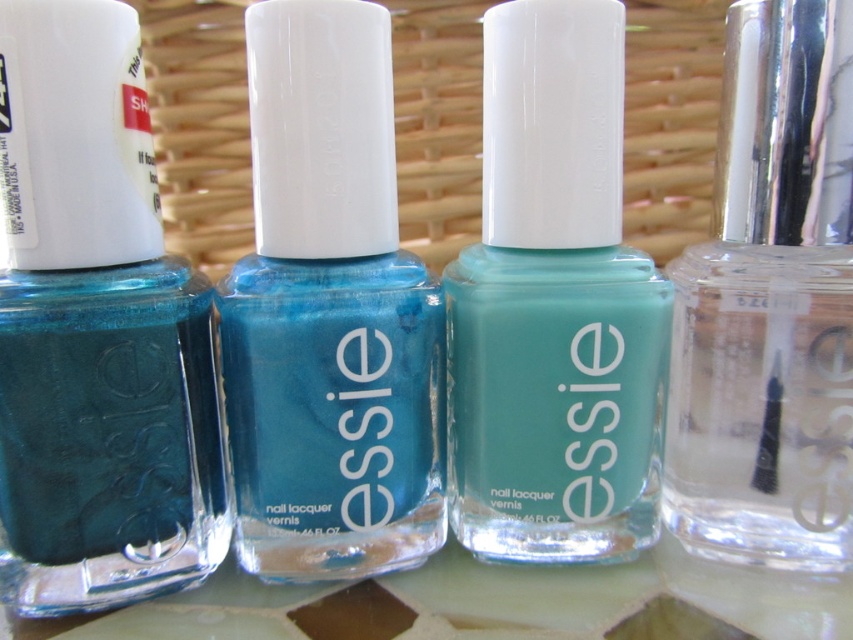
Who is more distant from viewer, (x=393, y=221) or (x=595, y=205)?

Point (x=595, y=205)

Can you confirm if shiny teal nail polish at center is positioned to the right of matte glass nail polish at center?

No, shiny teal nail polish at center is not to the right of matte glass nail polish at center.

Between point (328, 252) and point (502, 465), which one is positioned in front?

Point (328, 252) is more forward.

Find the location of `shiny teal nail polish at center`. shiny teal nail polish at center is located at coordinates (329, 314).

Which is more to the left, teal glossy nail polish at left or clear glass nail polish at right?

teal glossy nail polish at left

Is teal glossy nail polish at left shorter than clear glass nail polish at right?

Yes, teal glossy nail polish at left is shorter than clear glass nail polish at right.

Describe the element at coordinates (96, 330) in the screenshot. I see `teal glossy nail polish at left` at that location.

Identify the location of teal glossy nail polish at left. Image resolution: width=853 pixels, height=640 pixels. (96, 330).

Locate an element on the screen. This screenshot has height=640, width=853. teal glossy nail polish at left is located at coordinates (96, 330).

The width and height of the screenshot is (853, 640). Describe the element at coordinates (96, 330) in the screenshot. I see `teal glossy nail polish at left` at that location.

What do you see at coordinates (96, 330) in the screenshot? I see `teal glossy nail polish at left` at bounding box center [96, 330].

Locate an element on the screen. The width and height of the screenshot is (853, 640). teal glossy nail polish at left is located at coordinates (96, 330).